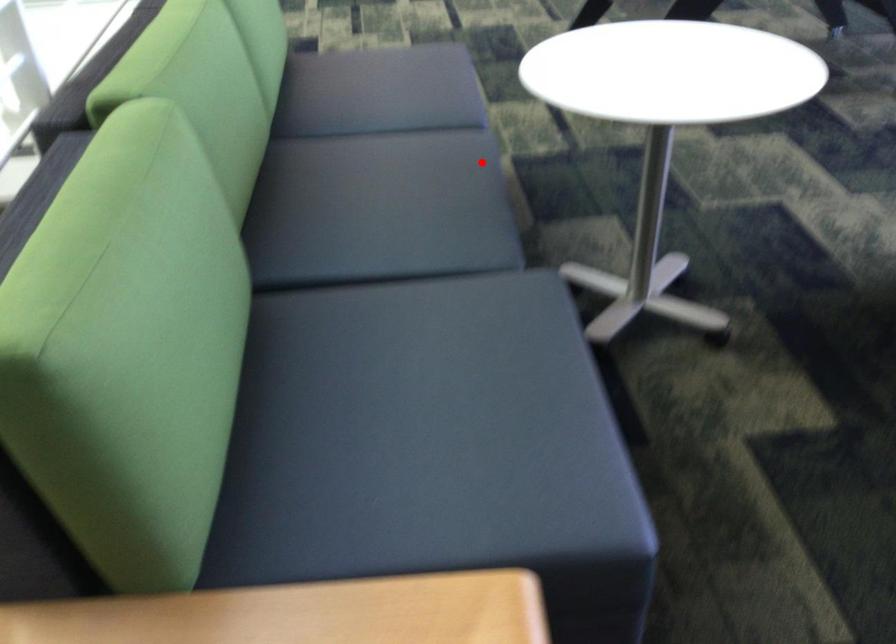
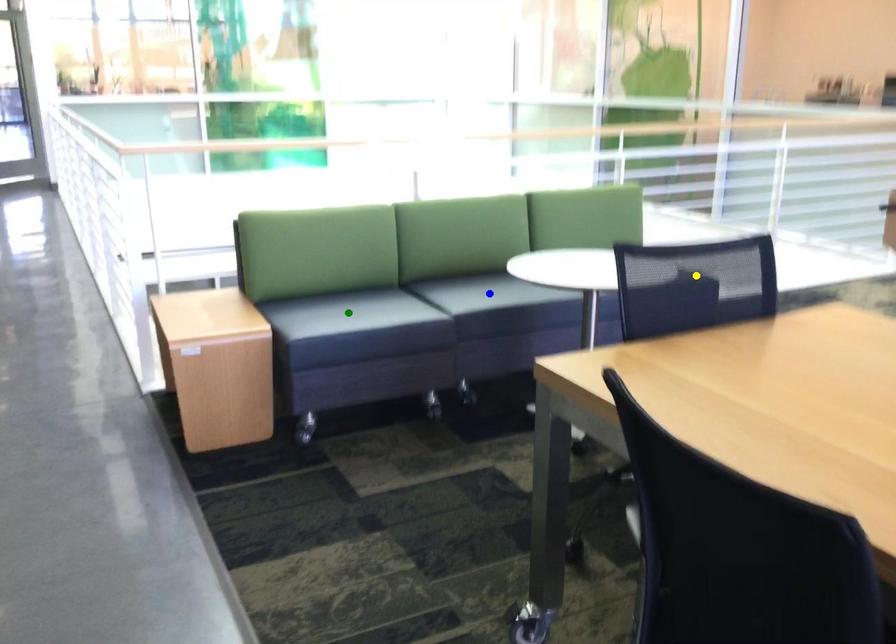
Question: I am providing you with two images of the same scene from different viewpoints. A red point is marked on the first image. You are given multiple points on the second image. Can you choose the point in image 2 that corresponds to the point in image 1?

Choices:
 (A) blue point
 (B) green point
 (C) yellow point

Answer: (A)